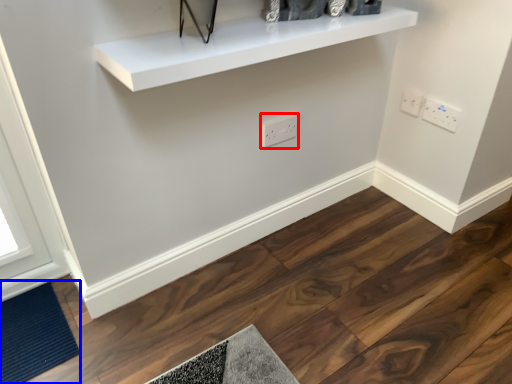
Question: Which object appears closest to the camera in this image, electric outlet (highlighted by a red box) or doormat (highlighted by a blue box)?

Choices:
 (A) electric outlet
 (B) doormat

Answer: (B)